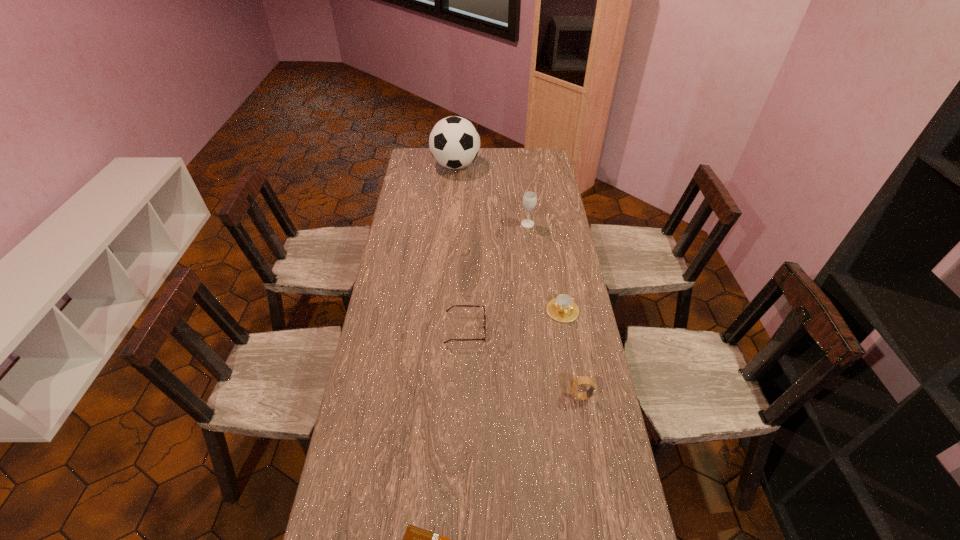
Identify the location of object that is positioned at the far left corner. The width and height of the screenshot is (960, 540). (454, 142).

This screenshot has width=960, height=540. What are the coordinates of `free space at the far edge of the desktop` in the screenshot? It's located at 483,155.

You are a GUI agent. You are given a task and a screenshot of the screen. Output one action in this format:
    pyautogui.click(x=<x>, y=<y>)
    Task: Click on the vacant area at the left edge
    
    Given the screenshot: What is the action you would take?
    pyautogui.click(x=429, y=190)

Identify the location of vacant position at the right edge of the desktop. (538, 244).

Where is `free point between the second farthest object and the farthest object`? free point between the second farthest object and the farthest object is located at coordinates (492, 195).

This screenshot has width=960, height=540. What are the coordinates of `free space between the fifth nearest object and the farthest object` in the screenshot? It's located at (492, 195).

The image size is (960, 540). I want to click on free point between the second shortest object and the fourth object from left to right, so click(496, 277).

Identify the location of free space between the spectacles and the farthest object. This screenshot has height=540, width=960. (461, 247).

Locate an element on the screen. This screenshot has height=540, width=960. unoccupied position between the spectacles and the second tallest object is located at coordinates (496, 277).

This screenshot has height=540, width=960. I want to click on vacant space that is in between the farthest object and the cup, so click(509, 238).